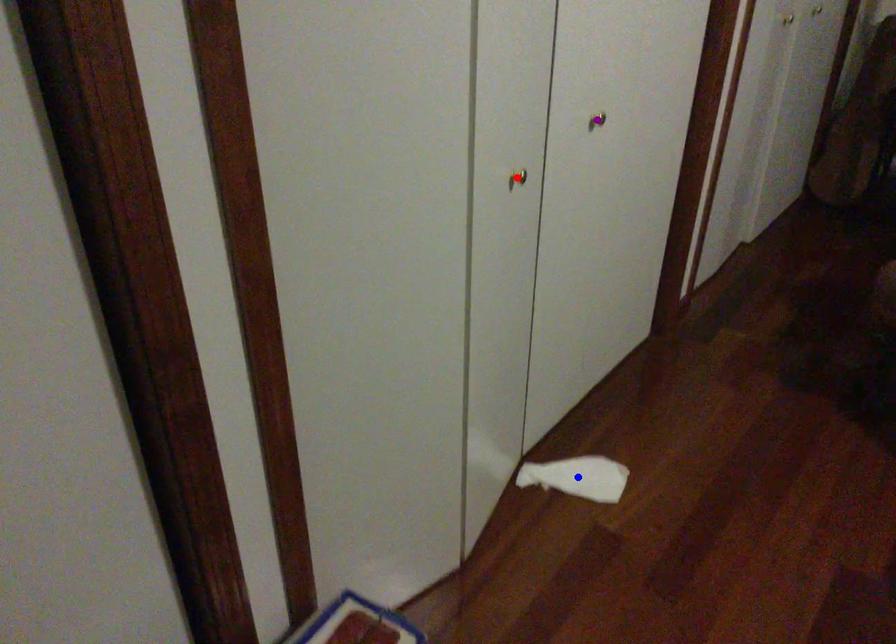
Order these from farthest to nearest:
- purple point
- red point
- blue point

1. blue point
2. purple point
3. red point